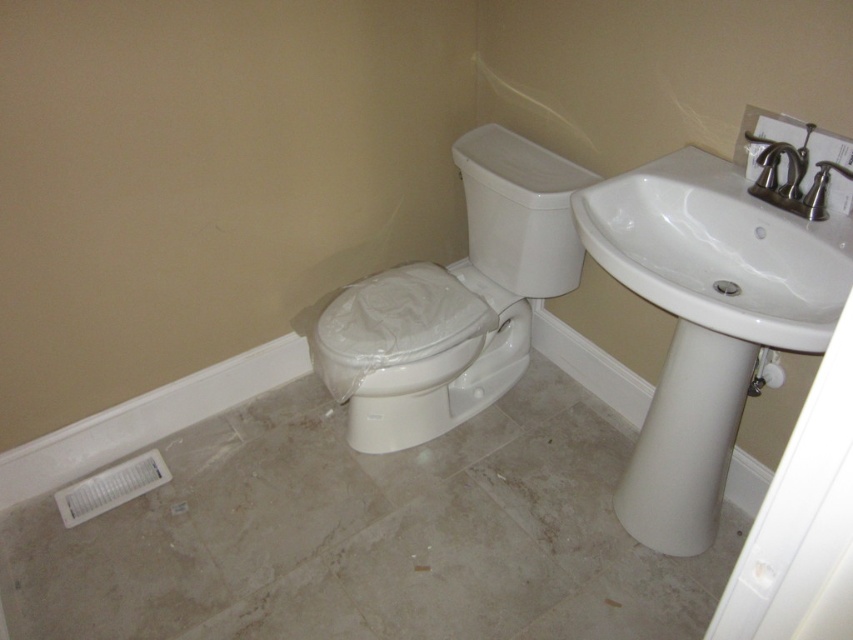
You are a plumber inspecting the bathroom corner. You see the white glossy sink at upper right and the matte black faucet at upper right. Which object is positioned to the left when viewed from the front?

The white glossy sink at upper right is to the left of the matte black faucet at upper right when viewed from the front.

You are designing a bathroom layout and want to ensure proper height for accessibility. Which object between the white glossy sink at upper right and the white glossy toilet bowl at center has a lower height?

The white glossy sink at upper right has a lesser height compared to the white glossy toilet bowl at center, so it is the lower one.